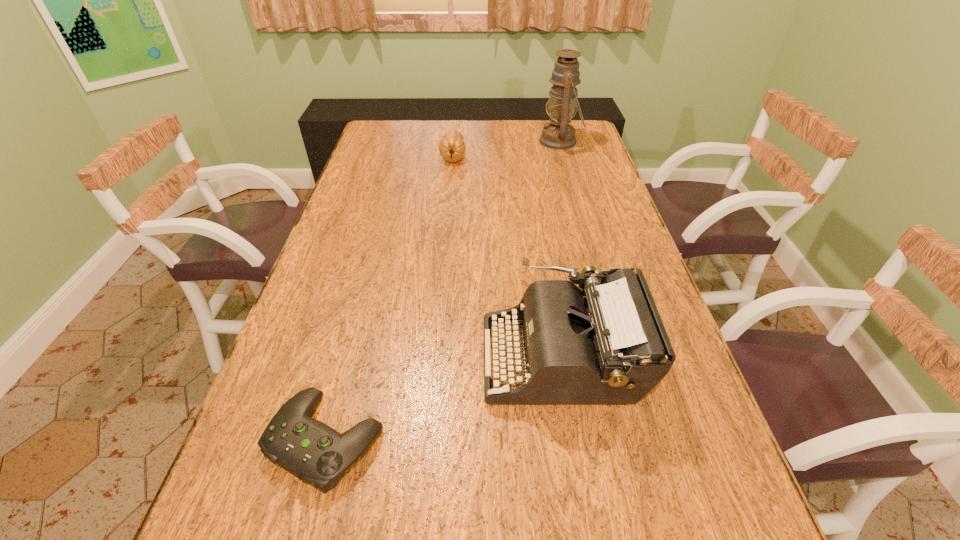
The image size is (960, 540). What are the coordinates of `vacant space at the right edge of the desktop` in the screenshot? It's located at (602, 232).

Identify the location of vacant space at the far left corner of the desktop. This screenshot has height=540, width=960. (372, 133).

Find the location of a particular element. vacant region between the typewriter and the gourd is located at coordinates (508, 257).

The image size is (960, 540). I want to click on free space that is in between the second tallest object and the oil lamp, so click(561, 249).

Image resolution: width=960 pixels, height=540 pixels. Find the location of `free space that is in between the oil lamp and the typewriter`. free space that is in between the oil lamp and the typewriter is located at coordinates (561, 249).

Where is `free space between the tallest object and the typewriter`? free space between the tallest object and the typewriter is located at coordinates (561, 249).

Identify the location of free point between the third shortest object and the tallest object. This screenshot has width=960, height=540. (561, 249).

The image size is (960, 540). In order to click on object that ranks as the closest to the shortest object in this screenshot , I will do `click(605, 344)`.

This screenshot has height=540, width=960. Find the location of `object that is the second closest to the tallest object`. object that is the second closest to the tallest object is located at coordinates pyautogui.click(x=605, y=344).

I want to click on free space that satisfies the following two spatial constraints: 1. on the front side of the tallest object; 2. on the front-facing side of the typewriter, so click(622, 357).